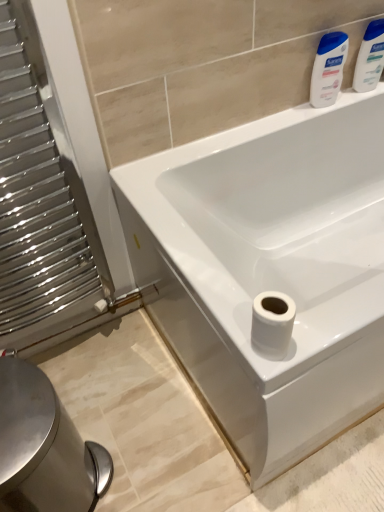
Identify the location of unoccupied space behind white matte toilet paper at lower right. This screenshot has width=384, height=512. (218, 291).